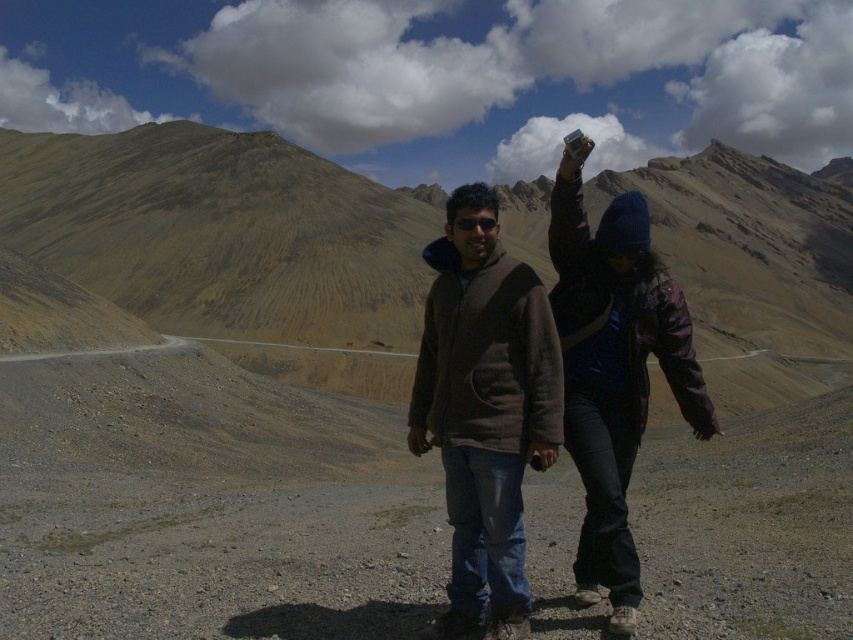
Can you confirm if brown fuzzy jacket at center is shorter than dark brown jacket at center?

Indeed, brown fuzzy jacket at center has a lesser height compared to dark brown jacket at center.

Which is above, brown fuzzy jacket at center or dark brown jacket at center?

dark brown jacket at center is higher up.

Does point (482, 429) lie in front of point (653, 273)?

Yes, it is in front of point (653, 273).

Identify the location of brown fuzzy jacket at center. The width and height of the screenshot is (853, 640). (x=485, y=412).

Between brown fuzzy jacket at center and black matte goggles at center, which one has more height?

Standing taller between the two is brown fuzzy jacket at center.

This screenshot has height=640, width=853. Describe the element at coordinates (485, 412) in the screenshot. I see `brown fuzzy jacket at center` at that location.

Does point (517, 502) come behind point (480, 224)?

No, (517, 502) is in front of (480, 224).

Locate an element on the screen. brown fuzzy jacket at center is located at coordinates (485, 412).

Can you confirm if dark brown jacket at center is taller than black matte goggles at center?

Indeed, dark brown jacket at center has a greater height compared to black matte goggles at center.

Between dark brown jacket at center and black matte goggles at center, which one is positioned higher?

Positioned higher is black matte goggles at center.

Between point (581, 259) and point (473, 220), which one is positioned in front?

Positioned in front is point (473, 220).

Where is `dark brown jacket at center`? dark brown jacket at center is located at coordinates (613, 369).